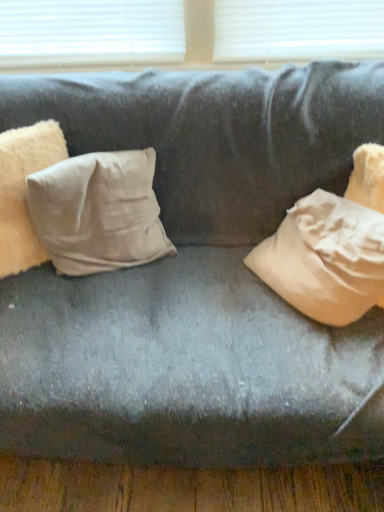
Question: From a real-world perspective, is beige cotton pillow at left, placed as the second pillow when sorted from right to left, on beige cotton pillow at center-left, which is the 2th pillow in left-to-right order?

Choices:
 (A) yes
 (B) no

Answer: (A)

Question: Is beige cotton pillow at left, marked as the first pillow in a left-to-right arrangement, shorter than beige cotton pillow at center-left, which is counted as the 1th pillow, starting from the right?

Choices:
 (A) yes
 (B) no

Answer: (B)

Question: Is beige cotton pillow at left, placed as the second pillow when sorted from right to left, bigger than beige cotton pillow at center-left, which is the 2th pillow in left-to-right order?

Choices:
 (A) no
 (B) yes

Answer: (A)

Question: Does beige cotton pillow at left, marked as the first pillow in a left-to-right arrangement, have a greater width compared to beige cotton pillow at center-left, which is counted as the 1th pillow, starting from the right?

Choices:
 (A) yes
 (B) no

Answer: (B)

Question: Does beige cotton pillow at left, placed as the second pillow when sorted from right to left, lie behind beige cotton pillow at center-left, which is counted as the 1th pillow, starting from the right?

Choices:
 (A) no
 (B) yes

Answer: (A)

Question: Is beige cotton pillow at left, placed as the second pillow when sorted from right to left, to the left of beige cotton pillow at center-left, which is the 2th pillow in left-to-right order, from the viewer's perspective?

Choices:
 (A) yes
 (B) no

Answer: (A)

Question: Is beige cotton pillow at center-left, which is counted as the 1th pillow, starting from the right, to the right of beige cotton pillow at left, placed as the second pillow when sorted from right to left, from the viewer's perspective?

Choices:
 (A) no
 (B) yes

Answer: (B)

Question: Is beige cotton pillow at left, marked as the first pillow in a left-to-right arrangement, surrounded by beige cotton pillow at center-left, which is counted as the 1th pillow, starting from the right?

Choices:
 (A) no
 (B) yes

Answer: (A)

Question: Is beige cotton pillow at center-left, which is counted as the 1th pillow, starting from the right, to the left of beige cotton pillow at left, marked as the first pillow in a left-to-right arrangement, from the viewer's perspective?

Choices:
 (A) no
 (B) yes

Answer: (A)

Question: Does beige cotton pillow at center-left, which is the 2th pillow in left-to-right order, have a greater width compared to beige cotton pillow at left, placed as the second pillow when sorted from right to left?

Choices:
 (A) yes
 (B) no

Answer: (A)

Question: Does beige cotton pillow at center-left, which is the 2th pillow in left-to-right order, come behind beige cotton pillow at left, marked as the first pillow in a left-to-right arrangement?

Choices:
 (A) no
 (B) yes

Answer: (B)

Question: Would you say beige cotton pillow at center-left, which is the 2th pillow in left-to-right order, is a long distance from beige cotton pillow at left, marked as the first pillow in a left-to-right arrangement?

Choices:
 (A) no
 (B) yes

Answer: (A)

Question: In terms of size, does beige cotton pillow at left, marked as the first pillow in a left-to-right arrangement, appear bigger or smaller than beige cotton pillow at center-left, which is the 2th pillow in left-to-right order?

Choices:
 (A) big
 (B) small

Answer: (B)